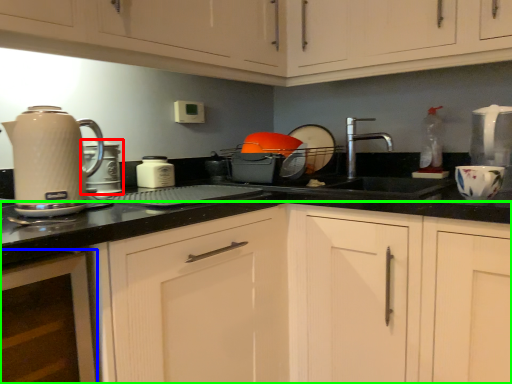
Question: Which object is positioned closest to kitchen appliance (highlighted by a red box)? Select from cabinetry (highlighted by a blue box) and cabinetry (highlighted by a green box).

Choices:
 (A) cabinetry
 (B) cabinetry

Answer: (A)